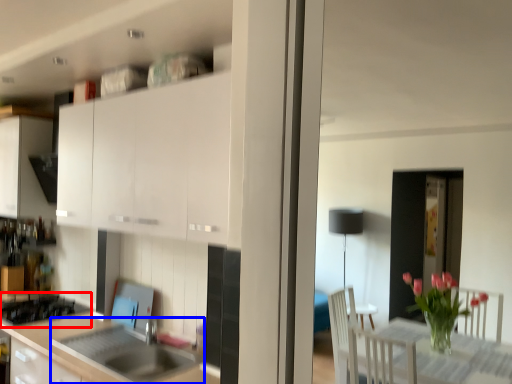
Question: Which object appears closest to the camera in this image, gas stove (highlighted by a red box) or sink (highlighted by a blue box)?

Choices:
 (A) gas stove
 (B) sink

Answer: (B)